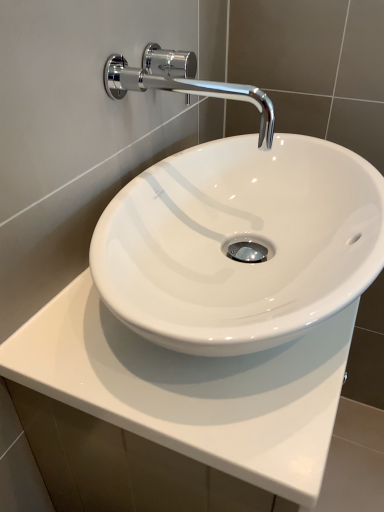
Question: Is white glossy countertop at center aimed at chrome/metallic faucet at upper center?

Choices:
 (A) no
 (B) yes

Answer: (A)

Question: From a real-world perspective, is white glossy countertop at center on chrome/metallic faucet at upper center?

Choices:
 (A) no
 (B) yes

Answer: (A)

Question: Does white glossy countertop at center have a larger size compared to chrome/metallic faucet at upper center?

Choices:
 (A) yes
 (B) no

Answer: (A)

Question: Can you confirm if white glossy countertop at center is positioned to the right of chrome/metallic faucet at upper center?

Choices:
 (A) no
 (B) yes

Answer: (B)

Question: From the image's perspective, is white glossy countertop at center above chrome/metallic faucet at upper center?

Choices:
 (A) yes
 (B) no

Answer: (B)

Question: Is chrome/metallic faucet at upper center at the back of white glossy countertop at center?

Choices:
 (A) no
 (B) yes

Answer: (A)

Question: From a real-world perspective, is chrome/metallic faucet at upper center under white glossy countertop at center?

Choices:
 (A) yes
 (B) no

Answer: (B)

Question: Considering the relative positions of chrome/metallic faucet at upper center and white glossy countertop at center in the image provided, is chrome/metallic faucet at upper center to the left of white glossy countertop at center from the viewer's perspective?

Choices:
 (A) yes
 (B) no

Answer: (A)

Question: Could you tell me if chrome/metallic faucet at upper center is turned towards white glossy countertop at center?

Choices:
 (A) yes
 (B) no

Answer: (B)

Question: From the image's perspective, is chrome/metallic faucet at upper center located above white glossy countertop at center?

Choices:
 (A) yes
 (B) no

Answer: (A)

Question: Can you confirm if chrome/metallic faucet at upper center is positioned to the right of white glossy countertop at center?

Choices:
 (A) no
 (B) yes

Answer: (A)

Question: Is chrome/metallic faucet at upper center not near white glossy countertop at center?

Choices:
 (A) no
 (B) yes

Answer: (A)

Question: Is point (66, 330) closer or farther from the camera than point (231, 92)?

Choices:
 (A) farther
 (B) closer

Answer: (B)